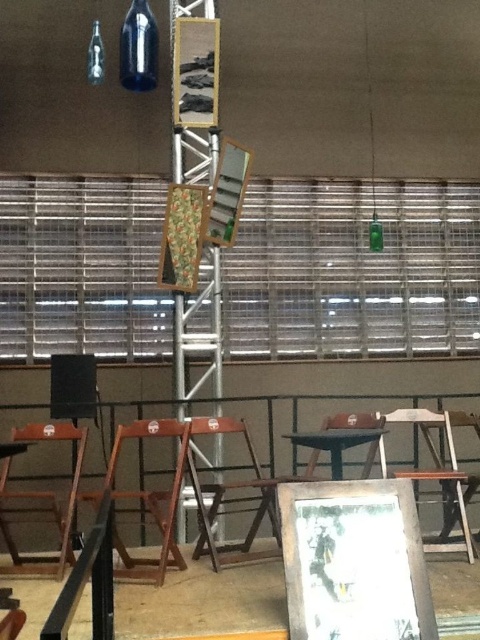
Can you confirm if wooden at lower left is shorter than blue glass bottle at upper left?

Incorrect, wooden at lower left's height does not fall short of blue glass bottle at upper left's.

Between wooden at lower left and blue glass bottle at upper left, which one is positioned lower?

wooden at lower left is lower down.

Between point (170, 436) and point (94, 45), which one is positioned behind?

Positioned behind is point (170, 436).

Identify the location of wooden at lower left. The width and height of the screenshot is (480, 640). (147, 500).

Does wooden at center have a lesser width compared to blue glass bottle at upper left?

In fact, wooden at center might be wider than blue glass bottle at upper left.

Can you confirm if wooden at center is positioned above blue glass bottle at upper left?

Incorrect, wooden at center is not positioned above blue glass bottle at upper left.

Is point (446, 429) closer to viewer compared to point (94, 20)?

Yes.

Identify the location of wooden at center. Image resolution: width=480 pixels, height=640 pixels. (459, 424).

Is brown wooden chair at center bigger than wooden at center?

Yes, brown wooden chair at center is bigger than wooden at center.

Who is lower down, brown wooden chair at center or wooden at center?

brown wooden chair at center

Is point (243, 420) closer to camera compared to point (465, 499)?

No, it is not.

The image size is (480, 640). In order to click on brown wooden chair at center in this screenshot , I will do `click(232, 499)`.